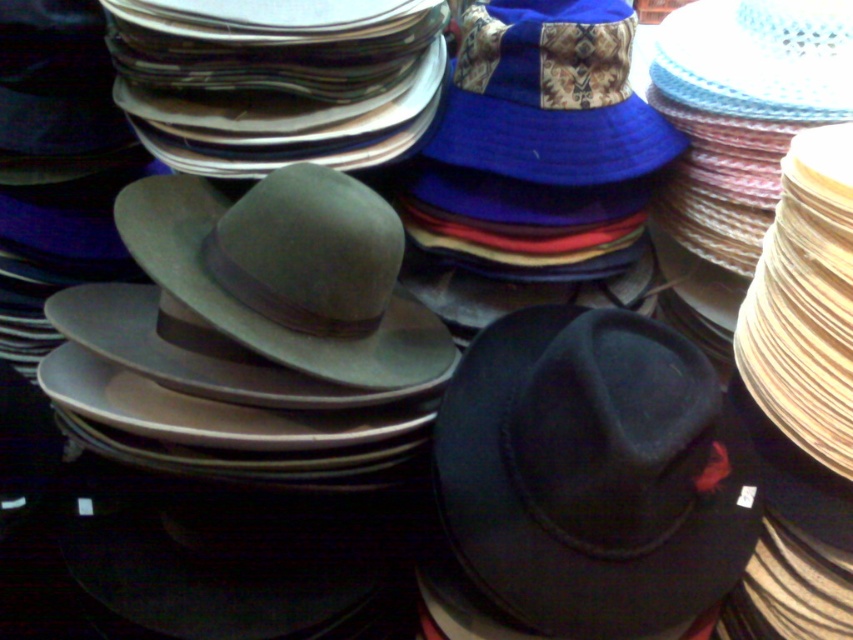
Where is the matte green felt fedora at center located in the image?

The matte green felt fedora at center is located at point 0.427 on the x axis and 0.341 on the y axis.

You are standing in front of a display of hats and need to determine which point is closer to you. The points are labeled as point 1 at coordinates point (556, 636) and point 2 at coordinates point (213, 241). Which point is closer to you?

Point (556, 636) is closer to the camera than point (213, 241), so point 1 is closer to you.

You are a customer at a hat store and want to buy a hat that is taller than the other. Which hat should you choose between the matte green felt fedora at center and the blue fabric cowboy hat at upper center?

The blue fabric cowboy hat at upper center is taller than the matte green felt fedora at center, so you should choose the blue fabric cowboy hat at upper center.